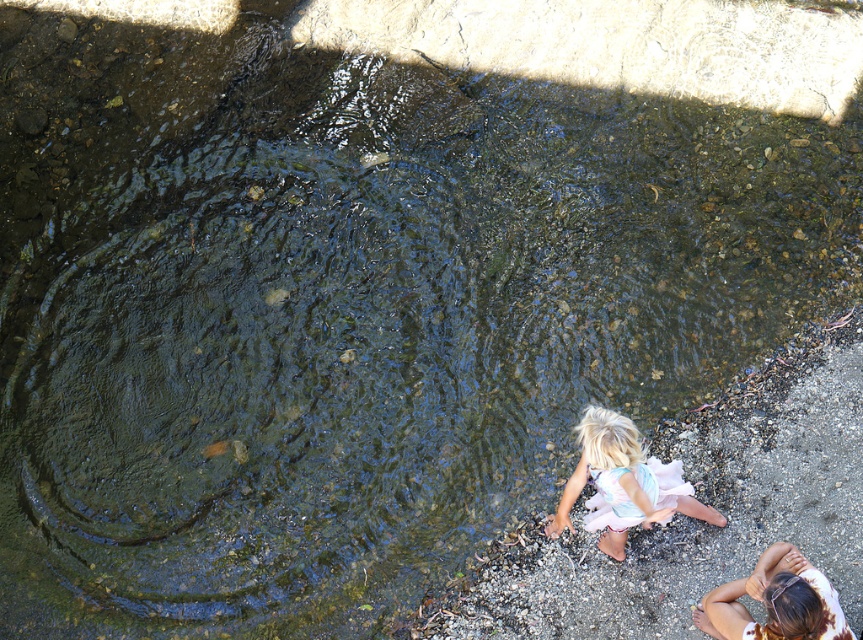
This screenshot has width=863, height=640. I want to click on pastel floral dress at lower right, so click(620, 481).

Which is above, pastel floral dress at lower right or light brown hair at lower right?

pastel floral dress at lower right

Does point (587, 465) lie behind point (732, 625)?

Yes, it is behind point (732, 625).

Locate an element on the screen. pastel floral dress at lower right is located at coordinates (620, 481).